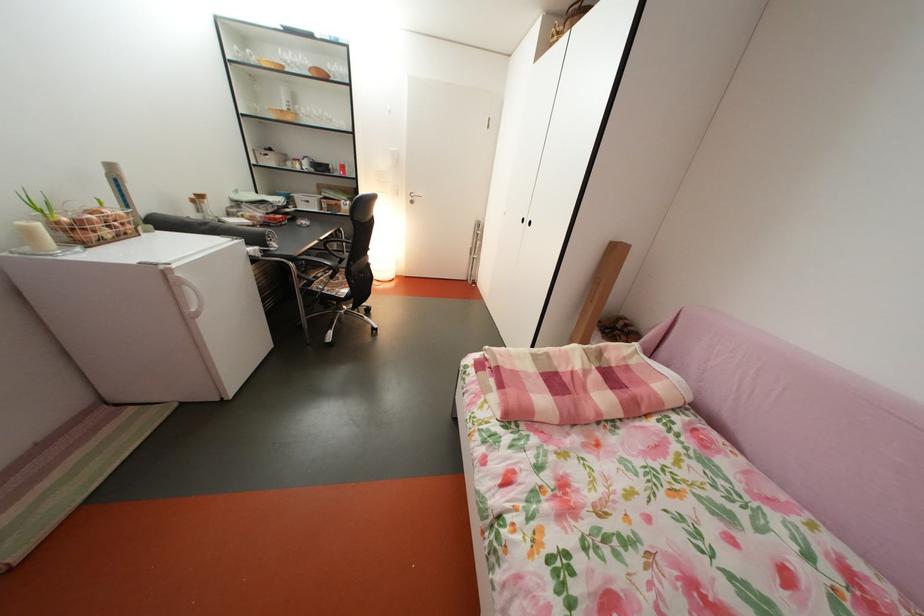
Where would you pull the white fridge handle? Please return your answer as a coordinate pair (x, y).

(190, 296)